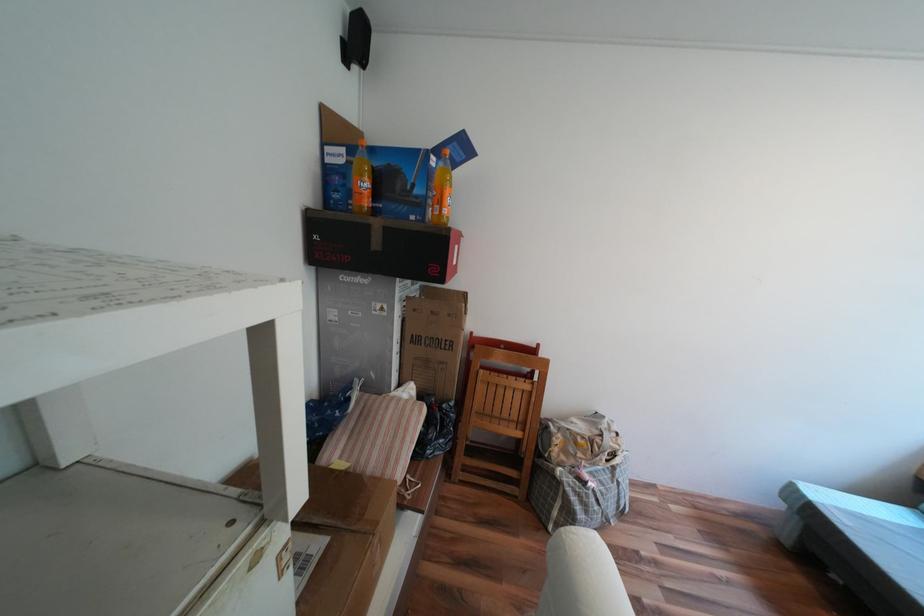
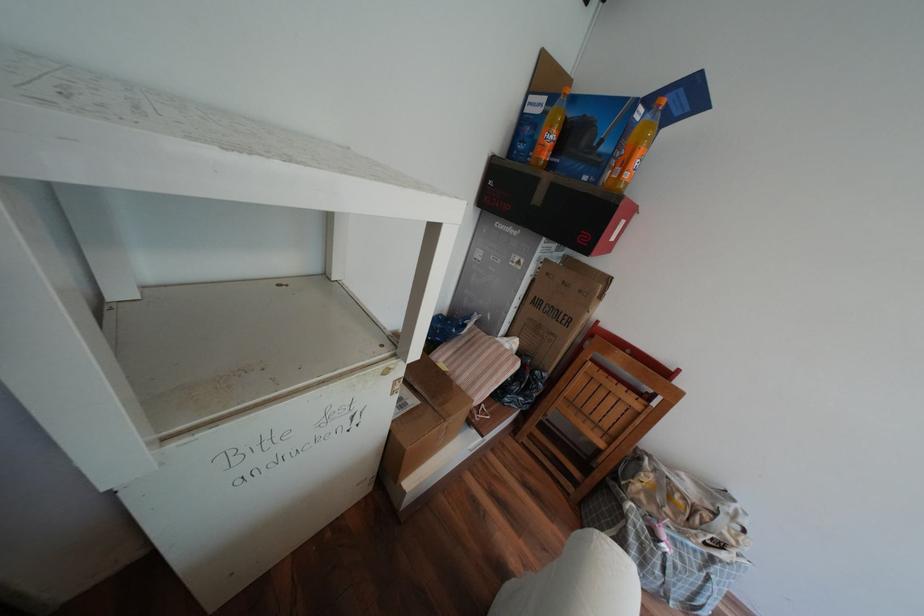
Where in the second image is the point corresponding to point 420,411 from the first image?

(517, 360)